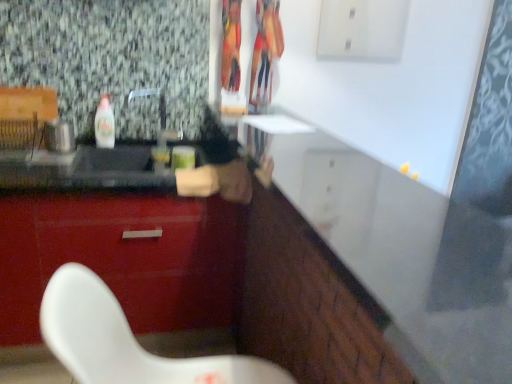
Question: Is white glossy counter at center facing away from glossy red cabinet at lower left?

Choices:
 (A) no
 (B) yes

Answer: (A)

Question: Could glossy red cabinet at lower left be considered to be inside white glossy counter at center?

Choices:
 (A) yes
 (B) no

Answer: (B)

Question: From the image's perspective, would you say white glossy counter at center is shown under glossy red cabinet at lower left?

Choices:
 (A) yes
 (B) no

Answer: (B)

Question: Is white glossy counter at center thinner than glossy red cabinet at lower left?

Choices:
 (A) yes
 (B) no

Answer: (B)

Question: Is white glossy counter at center at the right side of glossy red cabinet at lower left?

Choices:
 (A) no
 (B) yes

Answer: (B)

Question: Is glossy red cabinet at lower left wider or thinner than clear plastic bottle at left?

Choices:
 (A) thin
 (B) wide

Answer: (B)

Question: Is glossy red cabinet at lower left spatially inside clear plastic bottle at left, or outside of it?

Choices:
 (A) outside
 (B) inside

Answer: (A)

Question: Considering the relative positions of glossy red cabinet at lower left and clear plastic bottle at left in the image provided, is glossy red cabinet at lower left to the left or to the right of clear plastic bottle at left?

Choices:
 (A) right
 (B) left

Answer: (B)

Question: From the image's perspective, is glossy red cabinet at lower left positioned above or below clear plastic bottle at left?

Choices:
 (A) below
 (B) above

Answer: (A)

Question: Is clear plastic bottle at left in front of or behind glossy red cabinet at lower left in the image?

Choices:
 (A) behind
 (B) front

Answer: (A)

Question: In terms of width, does clear plastic bottle at left look wider or thinner when compared to glossy red cabinet at lower left?

Choices:
 (A) wide
 (B) thin

Answer: (B)

Question: Does point pos(105,114) appear closer or farther from the camera than point pos(198,231)?

Choices:
 (A) closer
 (B) farther

Answer: (B)

Question: Would you say clear plastic bottle at left is inside or outside glossy red cabinet at lower left?

Choices:
 (A) inside
 (B) outside

Answer: (B)

Question: Is white glossy counter at center taller or shorter than glossy red cabinet at lower left?

Choices:
 (A) short
 (B) tall

Answer: (A)

Question: Choose the correct answer: Is white glossy counter at center inside glossy red cabinet at lower left or outside it?

Choices:
 (A) outside
 (B) inside

Answer: (A)